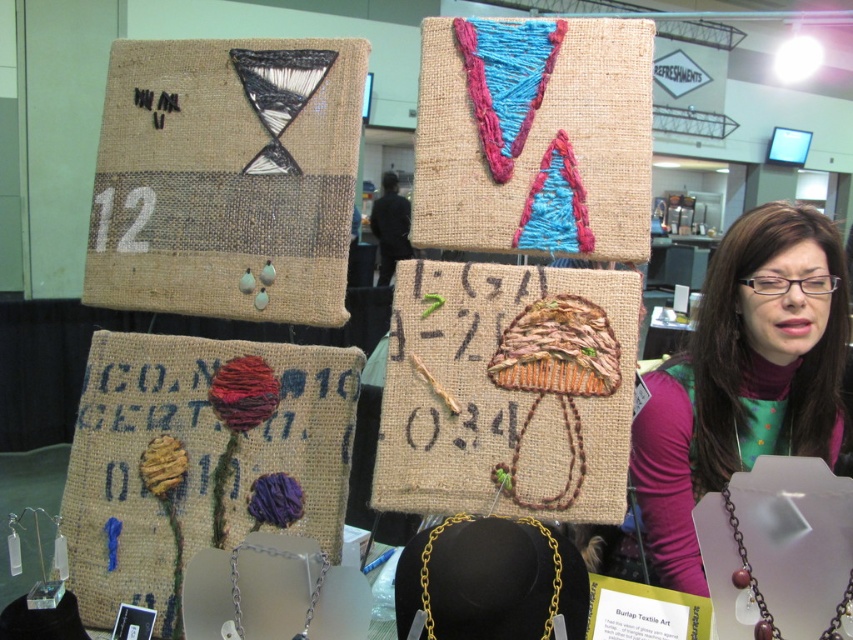
Does matte brown necklace at lower right appear on the left side of gold chain necklace at center?

In fact, matte brown necklace at lower right is to the right of gold chain necklace at center.

Can you confirm if matte brown necklace at lower right is positioned below gold chain necklace at center?

Incorrect, matte brown necklace at lower right is not positioned below gold chain necklace at center.

What do you see at coordinates (750, 576) in the screenshot? The width and height of the screenshot is (853, 640). I see `matte brown necklace at lower right` at bounding box center [750, 576].

Locate an element on the screen. Image resolution: width=853 pixels, height=640 pixels. matte brown necklace at lower right is located at coordinates click(x=750, y=576).

Is the position of matte black necklace at lower right more distant than that of matte brown necklace at lower right?

Yes, it is.

Which is more to the right, matte black necklace at lower right or matte brown necklace at lower right?

Positioned to the right is matte black necklace at lower right.

Find the location of a particular element. The image size is (853, 640). matte black necklace at lower right is located at coordinates (743, 378).

Consider the image. Does black fabric person at center appear over matte brown necklace at lower right?

Yes, black fabric person at center is above matte brown necklace at lower right.

Is black fabric person at center further to camera compared to matte brown necklace at lower right?

Yes, black fabric person at center is further from the viewer.

At what (x,y) coordinates should I click in order to perform the action: click on black fabric person at center. Please return your answer as a coordinate pair (x, y). This screenshot has width=853, height=640. Looking at the image, I should click on (390, 227).